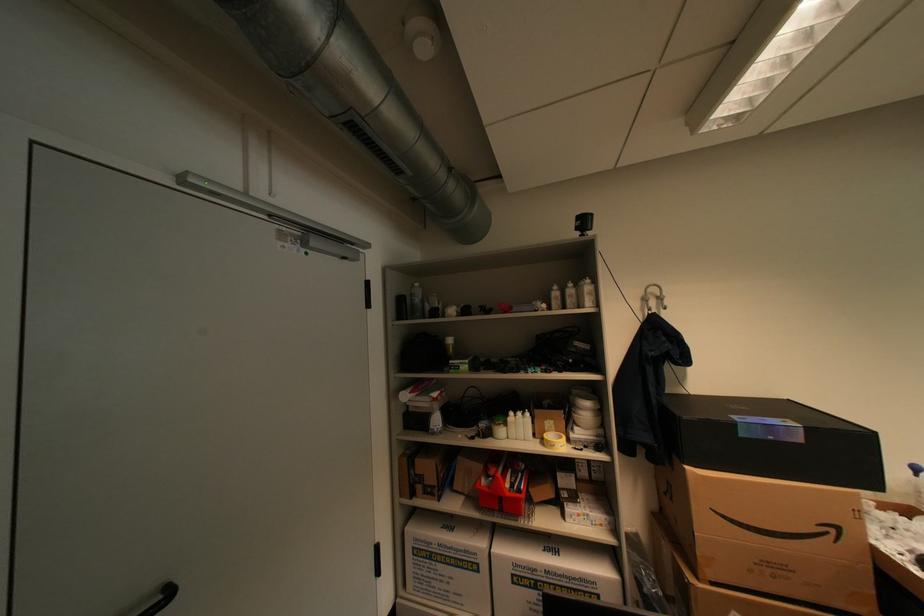
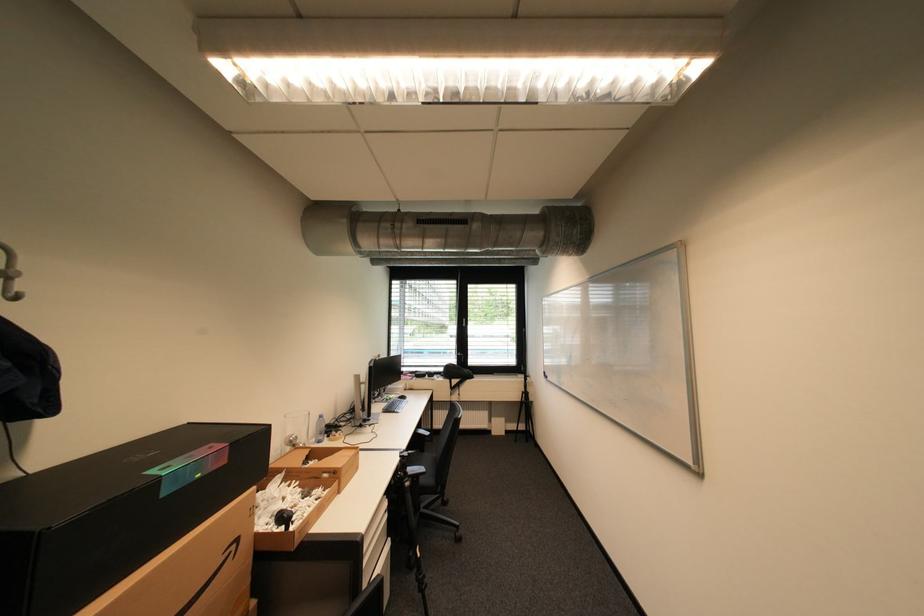
Question: The first image is from the beginning of the video and the second image is from the end. How did the camera likely rotate when shooting the video?

Choices:
 (A) Left
 (B) Right
 (C) Up
 (D) Down

Answer: (B)